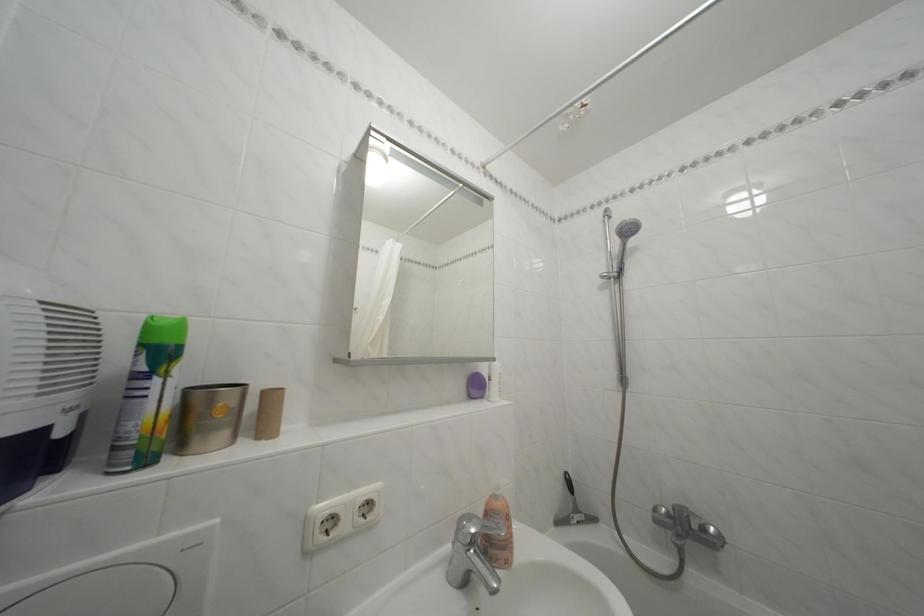
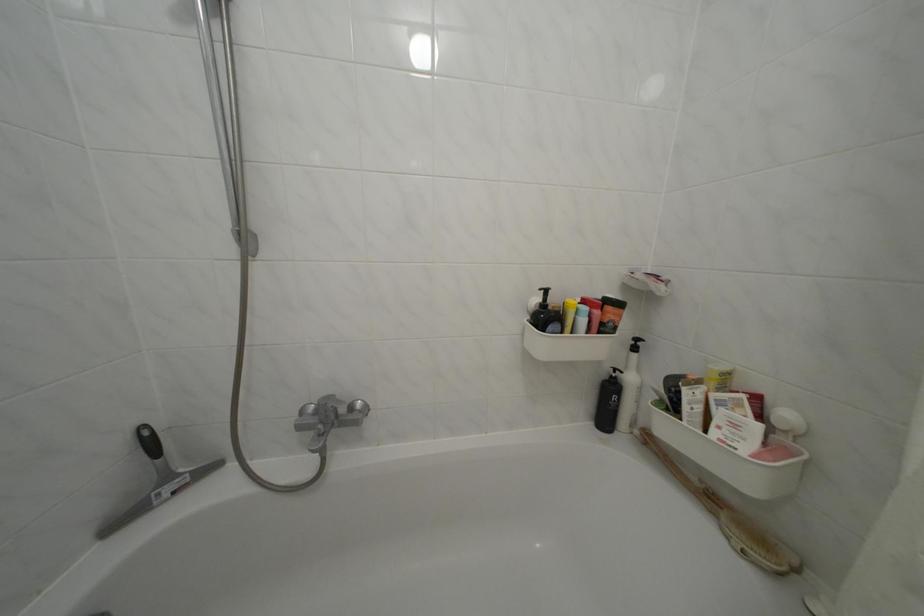
Locate, in the second image, the point that corresponds to point 713,536 in the first image.

(359, 414)